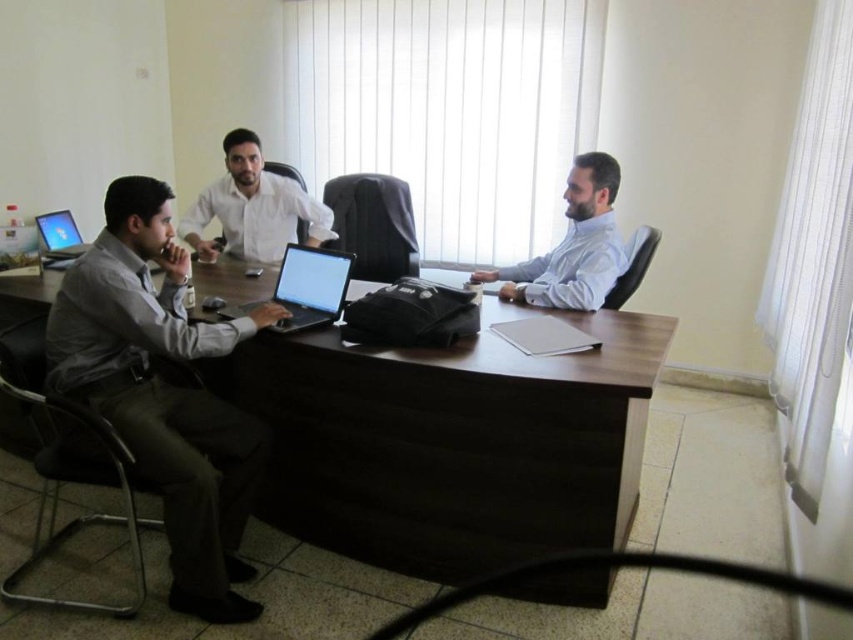
You are a delivery person who needs to place a small package on the table between the light blue shirt at right and the satin black laptop at left. Can you fit the package there if it measures 12 inches in length?

The distance between the light blue shirt at right and the satin black laptop at left is 31.80 inches. Since the package is only 12 inches long, there is enough space to place it between them.

You are organizing a photo shoot and need to arrange two shirts on a mannequin. The matte gray shirt at left is smaller in width than the white glossy shirt at center. Which shirt should you place on the mannequin first if you want to layer them with the wider shirt on top?

You should place the white glossy shirt at center first since it is wider than the matte gray shirt at left, allowing it to cover more area when layered on top.